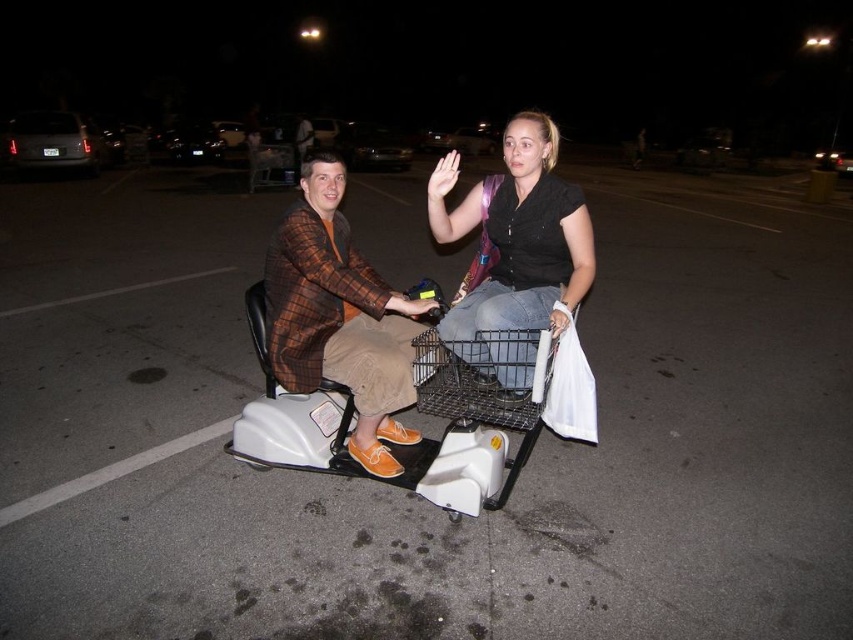
You are a delivery person who needs to navigate through a narrow alley that is only 1.2 meters wide. You are currently riding the matte black scooter at center with the matte black shirt at center passenger. Can you safely pass through the alley without hitting the walls?

The matte black scooter at center might be wider than matte black shirt at center. Since the alley is only 1.2 meters wide, if the scooter is wider than the passenger, it may not fit. However, without exact measurements, it is uncertain. Proceed with caution.